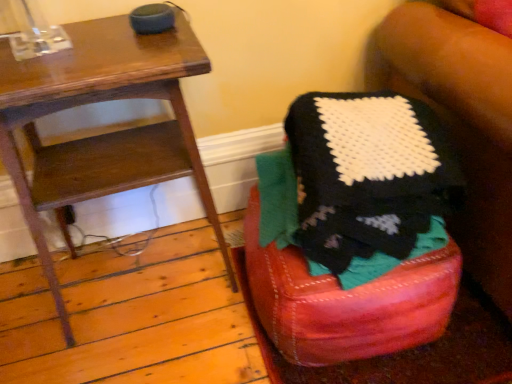
The height and width of the screenshot is (384, 512). I want to click on vacant space in wooden side table at left (from a real-world perspective), so click(x=150, y=268).